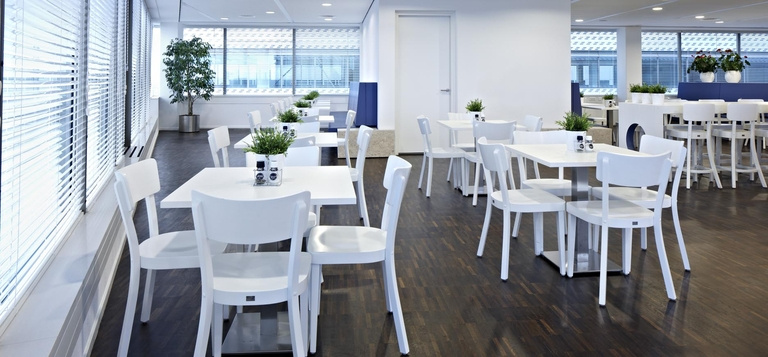
Where is `white table`? Image resolution: width=768 pixels, height=357 pixels. white table is located at coordinates (315, 189), (316, 137), (328, 116), (318, 100), (451, 124), (568, 149), (676, 104), (742, 103).